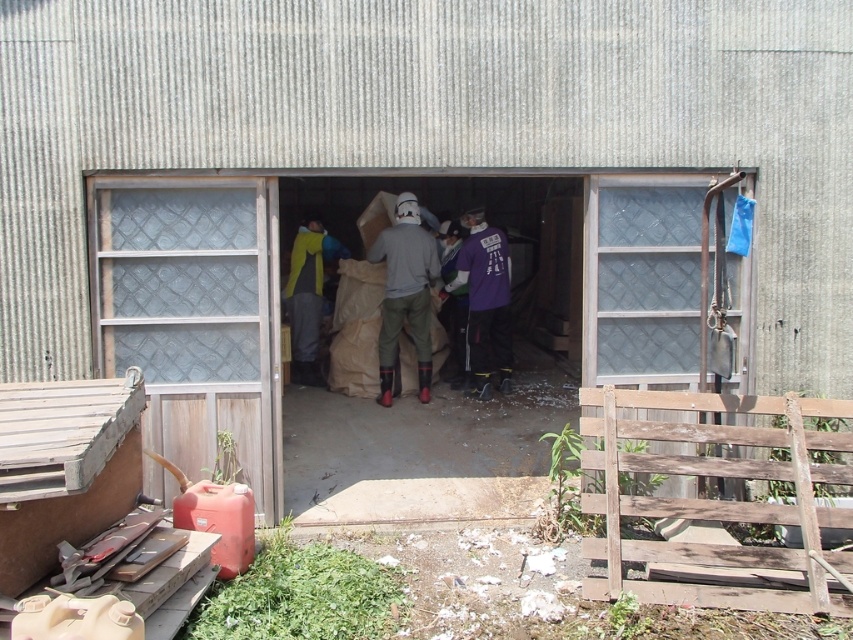
You are an inspector checking the safety of the outdoor area. You notice the clear glass door at left and the purple matte shirt at center. Which object is positioned lower in the scene?

The clear glass door at left is below purple matte shirt at center, so the clear glass door at left is positioned lower in the scene.

You are a delivery person who needs to enter the building through the clear glass door at left. However, you notice the purple fabric at center hanging in front of the door. Can you easily access the door without moving the fabric?

The clear glass door at left is positioned on the left side of the purple fabric at center, meaning the fabric is blocking the door. You will need to move the purple fabric at center to access the clear glass door at left.